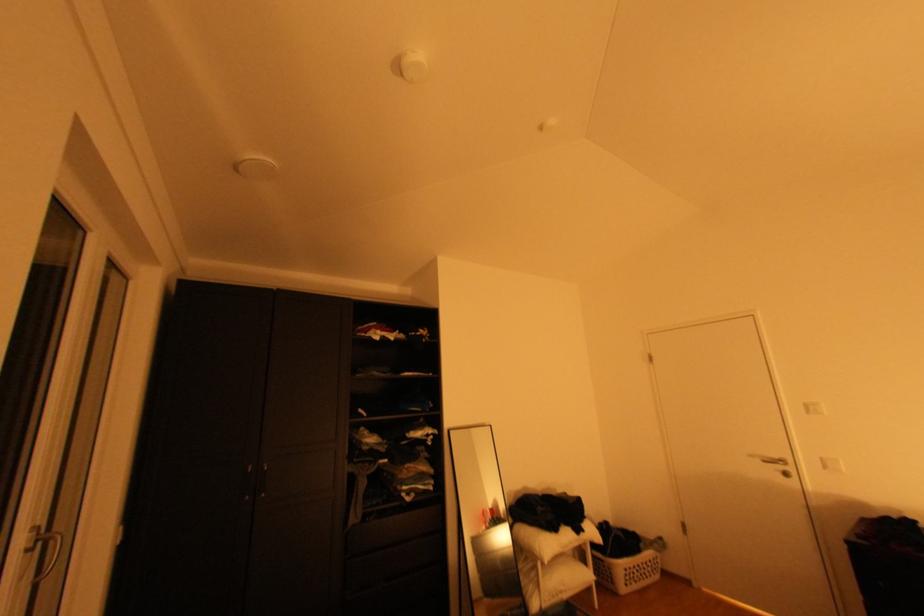
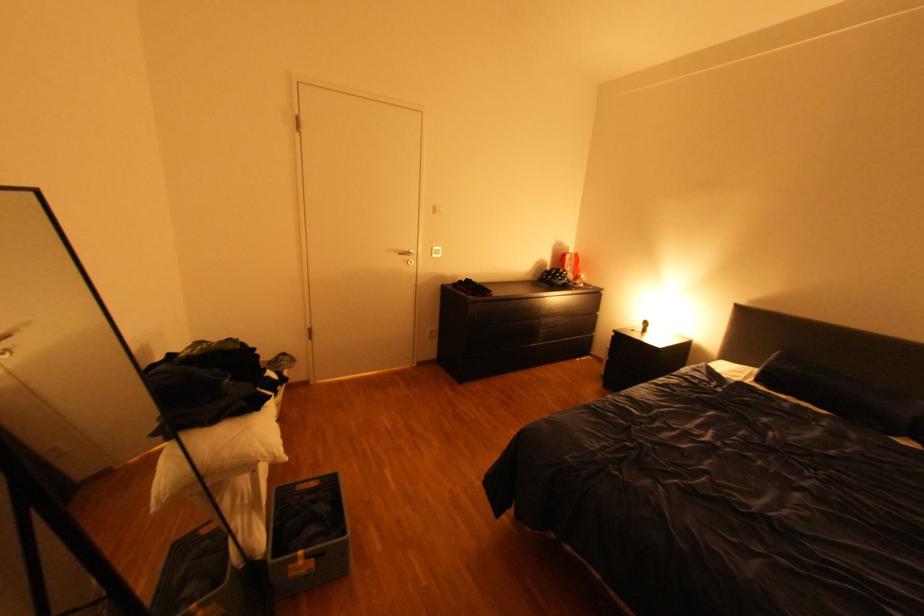
In the second image, find the point that corresponds to pixel 541 524 in the first image.

(223, 421)